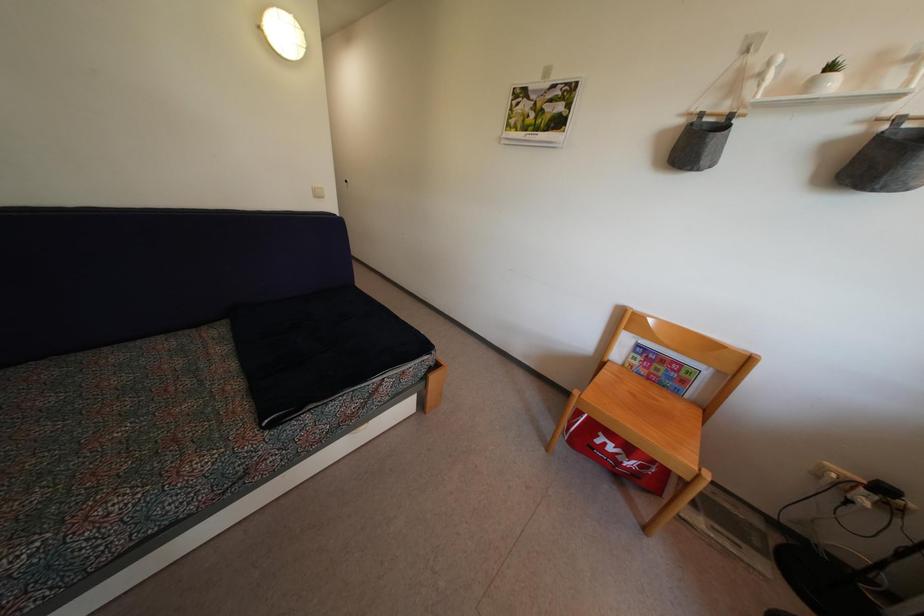
Locate an element on the screen. white light switch is located at coordinates (318, 192).